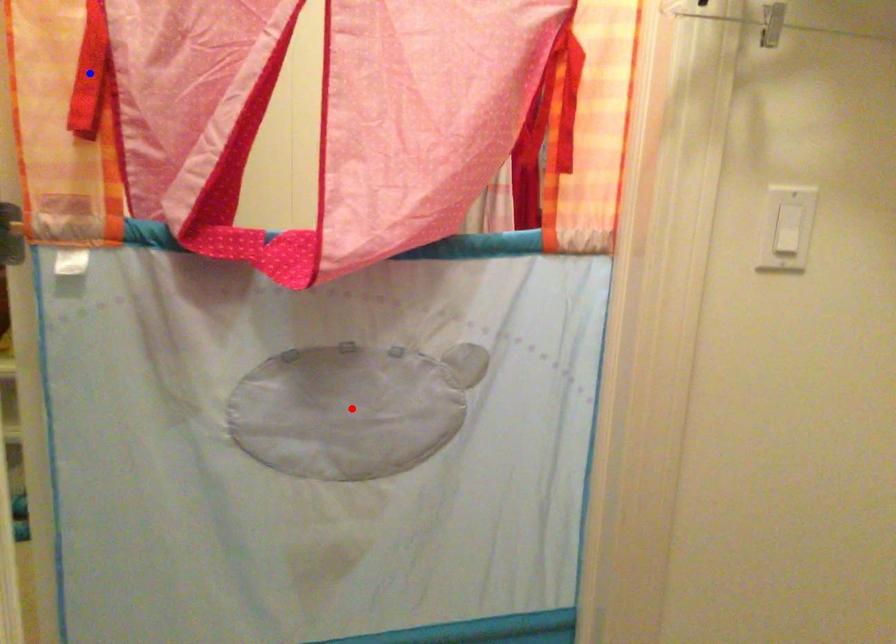
Question: In the image, two points are highlighted. Which point is nearer to the camera? Reply with the corresponding letter.

Choices:
 (A) blue point
 (B) red point

Answer: (A)